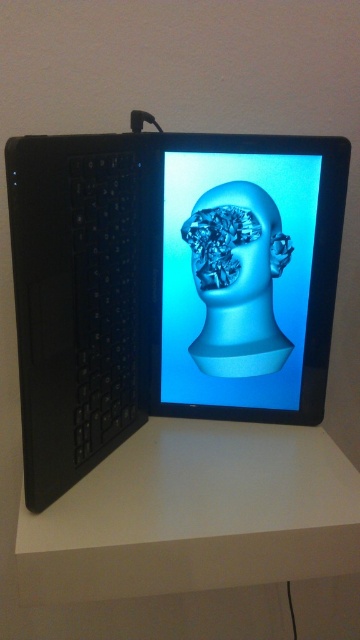
You are a delivery person who just received a transparent plastic head at center. You need to place it on a shelf that is 24 inches away from you. Can you safely place it without moving closer?

The transparent plastic head at center is currently 25.79 inches away from the viewer. Since the shelf is only 24 inches away, you can move closer to reach it and safely place the head on the shelf.

You are an artist who wants to place a small sculpture on the white matte table at center. The sculpture is exactly the same size as the transparent plastic head at center. Will the sculpture fit on the table without hanging over the edges?

The white matte table at center is larger in size than the transparent plastic head at center, so the sculpture will fit on the table without hanging over the edges.

You are a photographer setting up a shoot. You have a black matte laptop at center and a white matte table at center in your scene. To ensure proper focus, you need to know which object is closer to the camera. Which one should you focus on first?

The black matte laptop at center is closer to the viewer than the white matte table at center, so you should focus on the black matte laptop at center first.